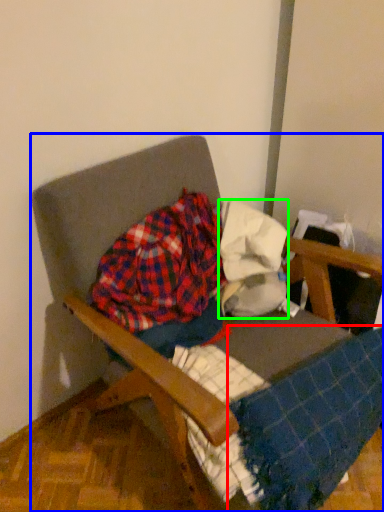
Question: Which object is the farthest from blanket (highlighted by a red box)? Choose among these: chair (highlighted by a blue box) or fabric (highlighted by a green box).

Choices:
 (A) chair
 (B) fabric

Answer: (A)